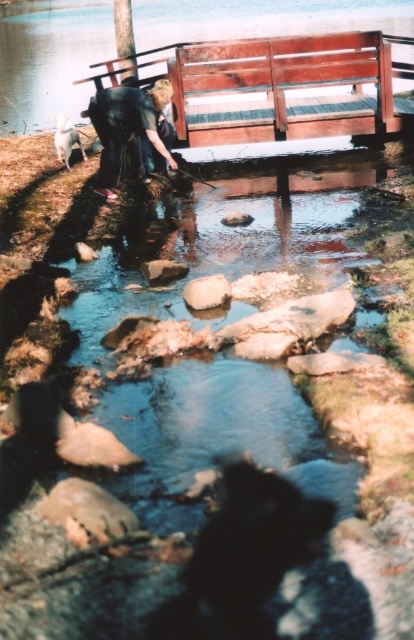
You are a person who is 5 feet tall and want to sit on the wooden bench at upper center. The dark blue fabric at center is in your way. Can you step over it?

The wooden bench at upper center and dark blue fabric at center are 5.12 feet apart from each other. Since the distance between them is greater than your height, you can safely step over the dark blue fabric at center to reach the wooden bench at upper center.

You are a hiker who wants to place a small backpack on the wooden bench at upper center. However, there is a white smooth rock at center on the bench. Can you place your backpack there without moving the rock?

The wooden bench at upper center is positioned over white smooth rock at center, so the rock is not on the bench. Therefore, you can safely place your backpack on the wooden bench at upper center without moving the rock.

You are standing at the edge of the stream and want to sit on the smooth wooden bench at upper center. However, there is a dark blue fabric at center in your path. Which object is closer to you, the bench or the fabric?

The smooth wooden bench at upper center is closer to you than the dark blue fabric at center, so you can reach the bench without stepping on the fabric.